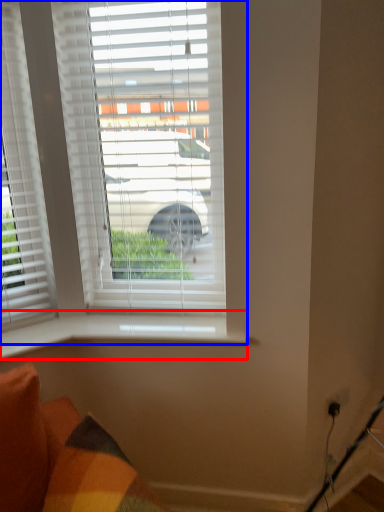
Question: Which of the following is the closest to the observer, window sill (highlighted by a red box) or window (highlighted by a blue box)?

Choices:
 (A) window sill
 (B) window

Answer: (B)